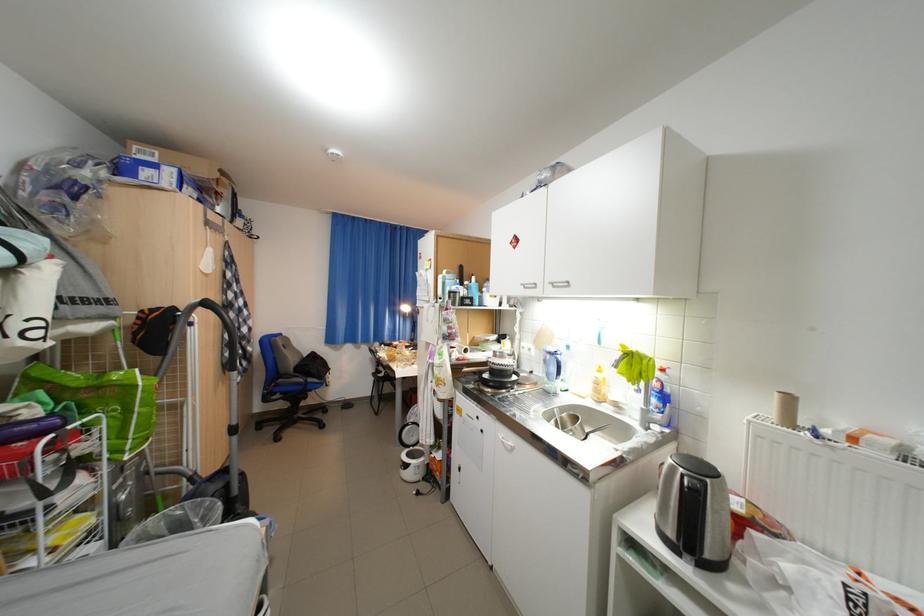
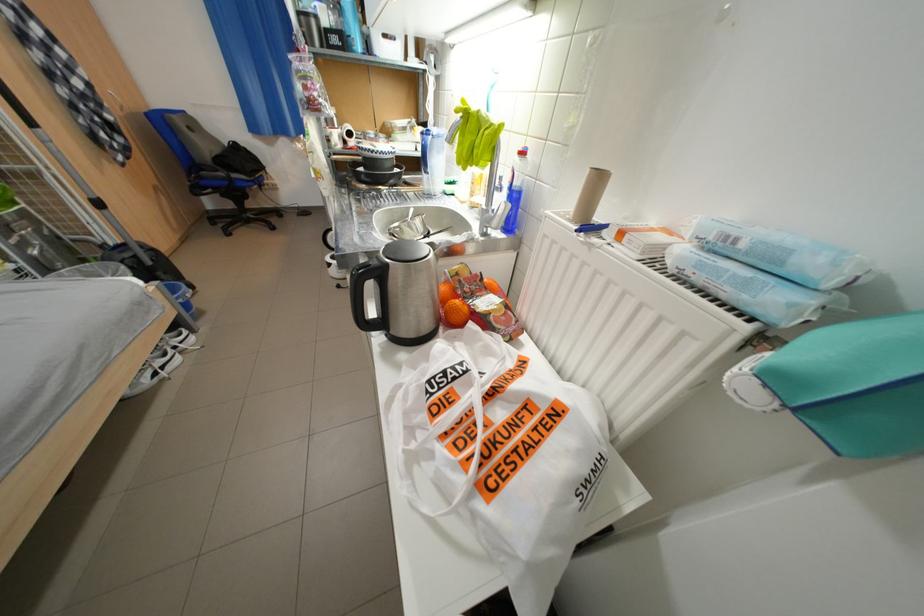
Question: The images are taken continuously from a first-person perspective. In which direction is your viewpoint rotating?

Choices:
 (A) Left
 (B) Right
 (C) Up
 (D) Down

Answer: (D)